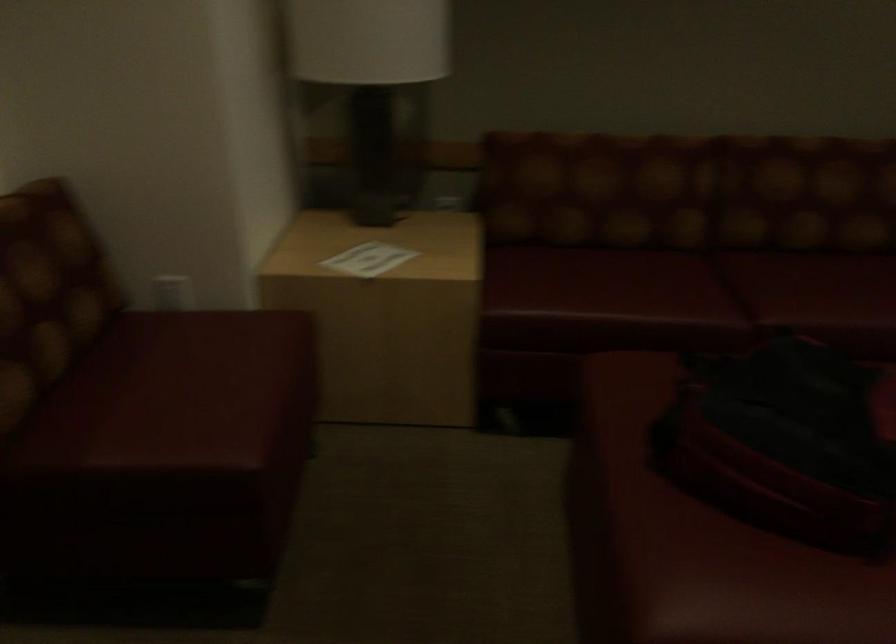
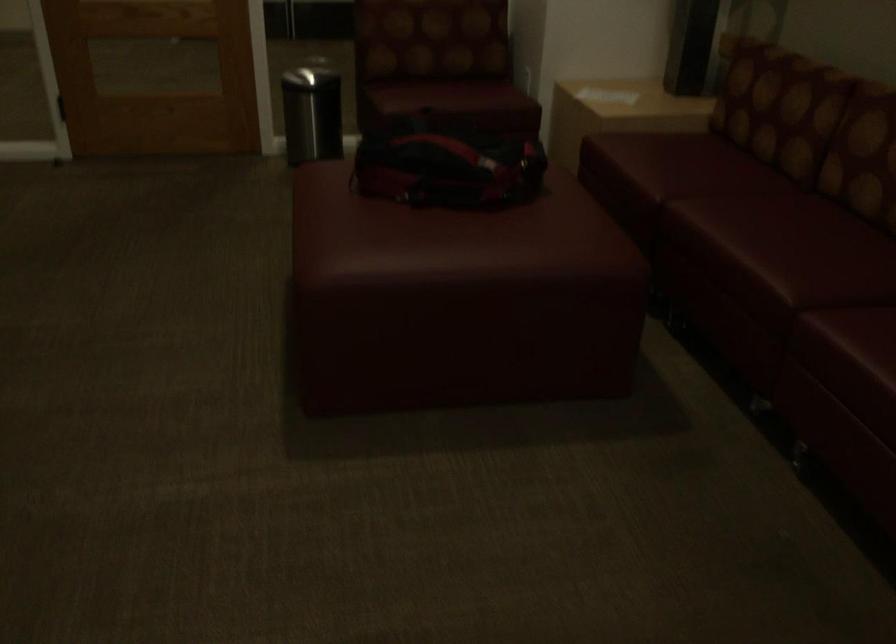
The point at (247, 388) is marked in the first image. Where is the corresponding point in the second image?

(448, 96)